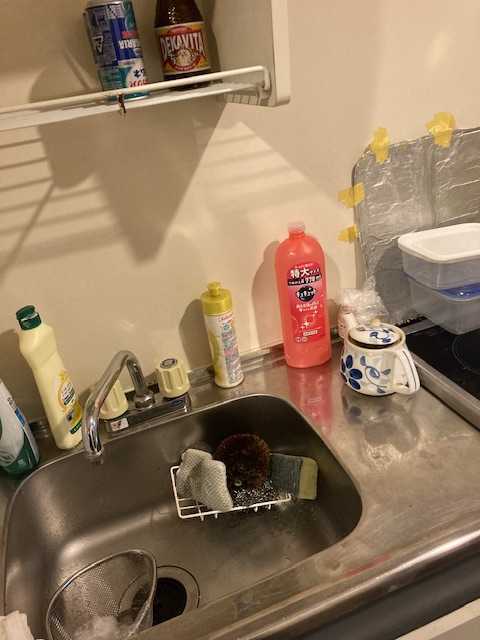
The height and width of the screenshot is (640, 480). Identify the location of stove. (461, 364).